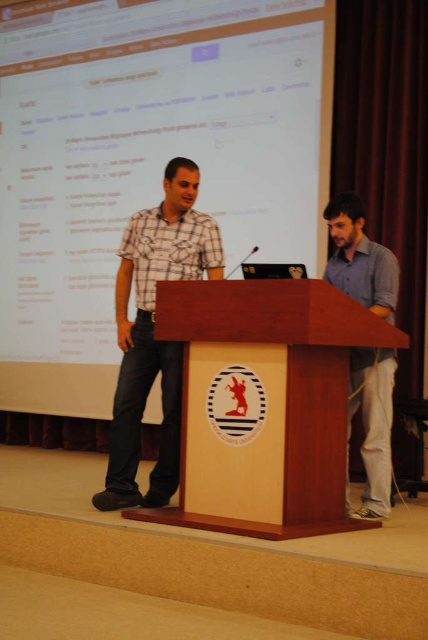
Question: Is plaid shirt at center to the left of matte black screen at center from the viewer's perspective?

Choices:
 (A) no
 (B) yes

Answer: (B)

Question: Which of the following is the closest to the observer?

Choices:
 (A) gray cotton shirt at right
 (B) plaid shirt at center
 (C) wooden podium at center
 (D) matte black screen at center

Answer: (C)

Question: Which point is closer to the camera?

Choices:
 (A) matte white screen at upper center
 (B) plaid shirt at center
 (C) gray cotton shirt at right

Answer: (B)

Question: Estimate the real-world distances between objects in this image. Which object is closer to the matte white screen at upper center?

Choices:
 (A) plaid shirt at center
 (B) gray cotton shirt at right

Answer: (A)

Question: Does plaid shirt at center appear on the left side of matte black screen at center?

Choices:
 (A) yes
 (B) no

Answer: (A)

Question: Is matte white screen at upper center bigger than matte black screen at center?

Choices:
 (A) yes
 (B) no

Answer: (A)